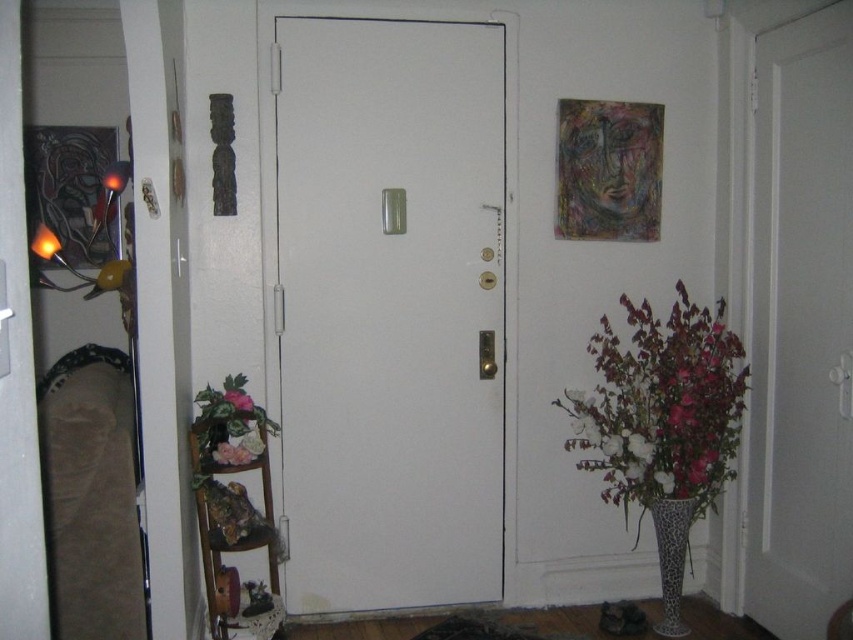
You are standing in the hallway and need to open the white matte door at center. Based on its position, can you estimate whether it opens towards you or away from you?

The white matte door at center is located at point coordinates that suggest it opens away from you, as doors typically open away from their hinges. However, without specific hinge details, this is an approximation based on standard door placement.

You are standing in the hallway and want to place a new picture frame between the pink matte flower at center and the white matte vase at lower right. Based on their positions, where should you place the frame?

The pink matte flower at center is closer to the viewer than the white matte vase at lower right, so you should place the frame between them along the line of sight, closer to the flower to maintain balance.